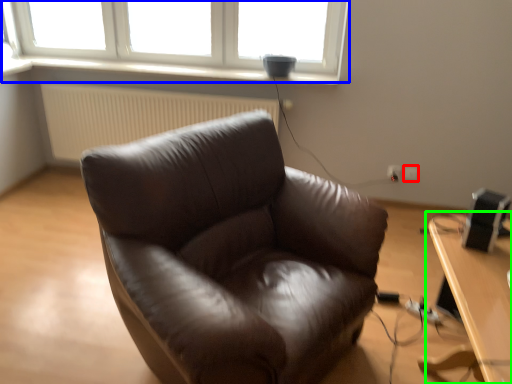
Question: Which is farther away from electric outlet (highlighted by a red box)? window (highlighted by a blue box) or table (highlighted by a green box)?

Choices:
 (A) window
 (B) table

Answer: (A)